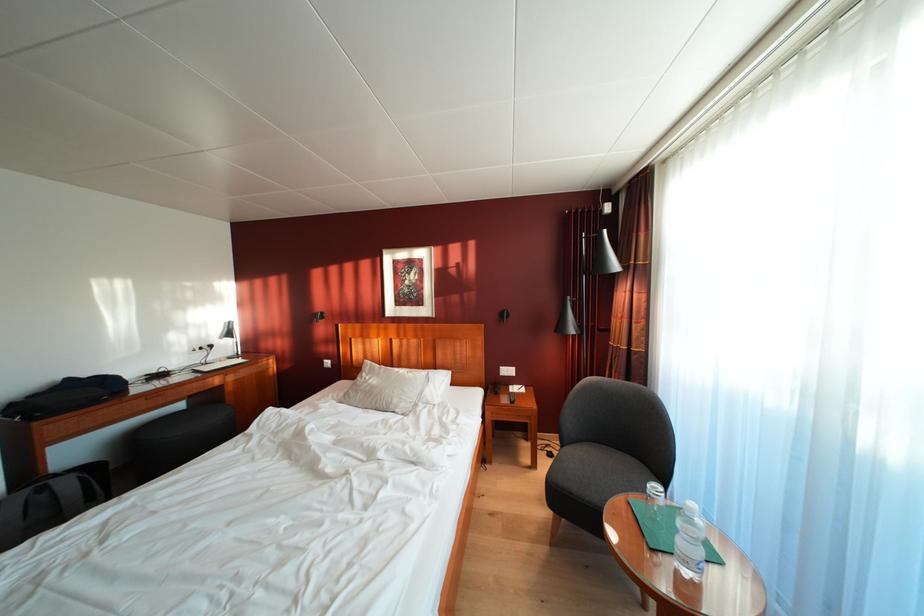
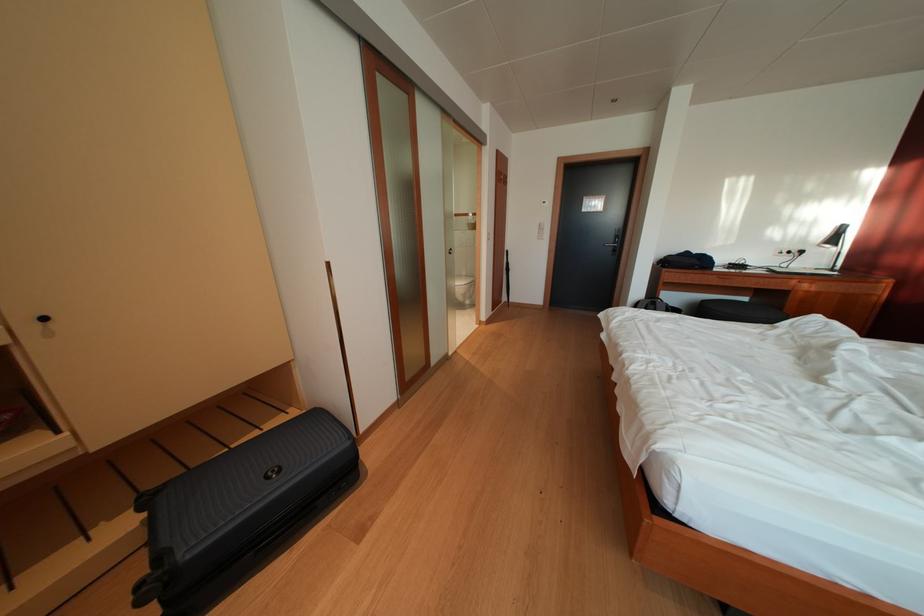
Locate, in the second image, the point that corresponds to pixel 220 353 in the first image.

(809, 257)